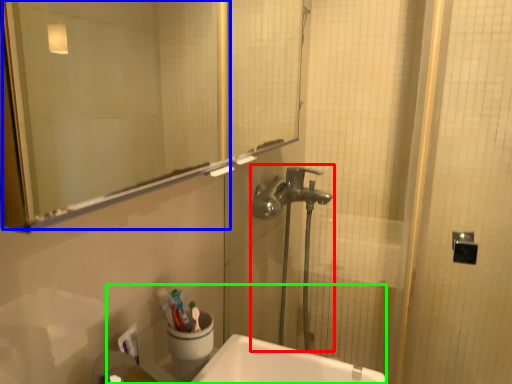
Question: Which object is the farthest from plumbing fixture (highlighted by a red box)? Choose among these: mirror (highlighted by a blue box) or sink (highlighted by a green box).

Choices:
 (A) mirror
 (B) sink

Answer: (A)